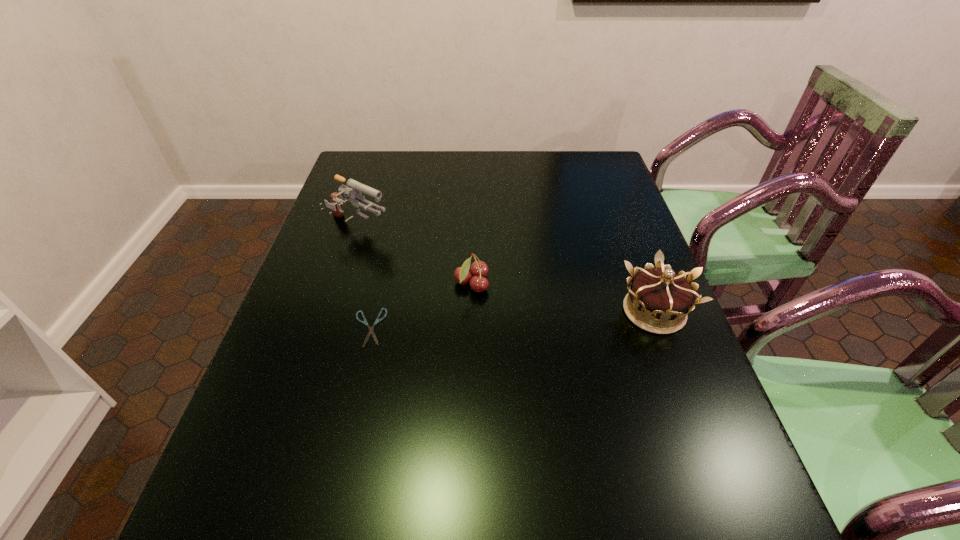
Identify the location of shears. (378, 320).

At what (x,y) coordinates should I click in order to perform the action: click on crown. Please return your answer as a coordinate pair (x, y). This screenshot has width=960, height=540. Looking at the image, I should click on (656, 296).

Identify the location of the second object from right to left. (479, 269).

At what (x,y) coordinates should I click in order to perform the action: click on cherry. Please return your answer as a coordinate pair (x, y). The width and height of the screenshot is (960, 540). Looking at the image, I should click on (479, 269).

This screenshot has width=960, height=540. Identify the location of gun. (353, 189).

Image resolution: width=960 pixels, height=540 pixels. Identify the location of vacant point located 0.400m on the right of the shears. (558, 327).

The width and height of the screenshot is (960, 540). Find the location of `free space located 0.240m on the back of the crown`. free space located 0.240m on the back of the crown is located at coordinates (621, 225).

Image resolution: width=960 pixels, height=540 pixels. What are the coordinates of `vacant point located 0.140m on the leaves of the cherry` in the screenshot? It's located at click(x=538, y=313).

Identify the location of vacant space located on the leaves of the cherry. (642, 355).

At what (x,y) coordinates should I click in order to perform the action: click on free point located 0.120m on the leaves of the cherry. Please return your answer as a coordinate pair (x, y). Looking at the image, I should click on (530, 309).